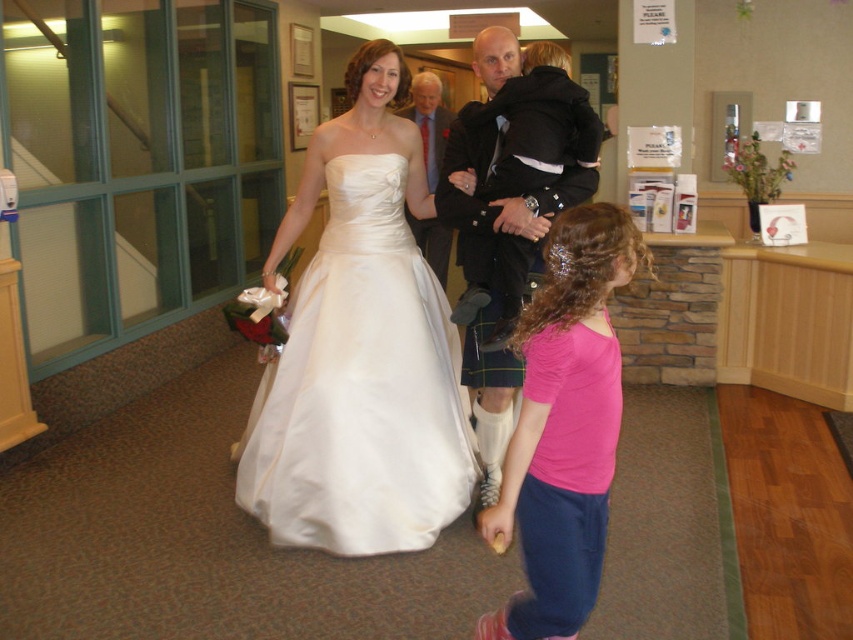
You are a photographer positioned at the entrance of the room and want to capture a photo of both the white satin dress at center and the black kilt at center. Which one will appear larger in the photo?

The white satin dress at center will appear larger in the photo because it is closer to the viewer than the black kilt at center.